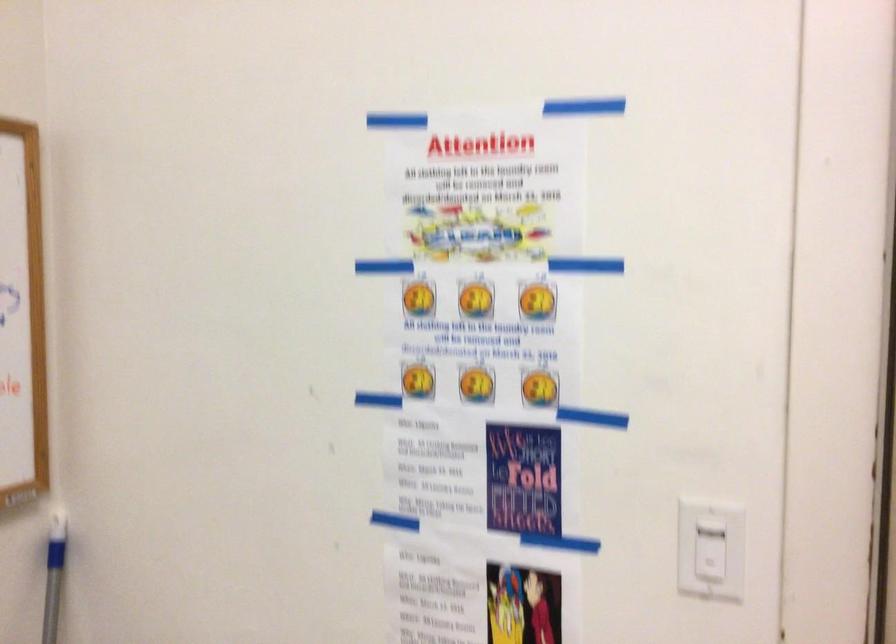
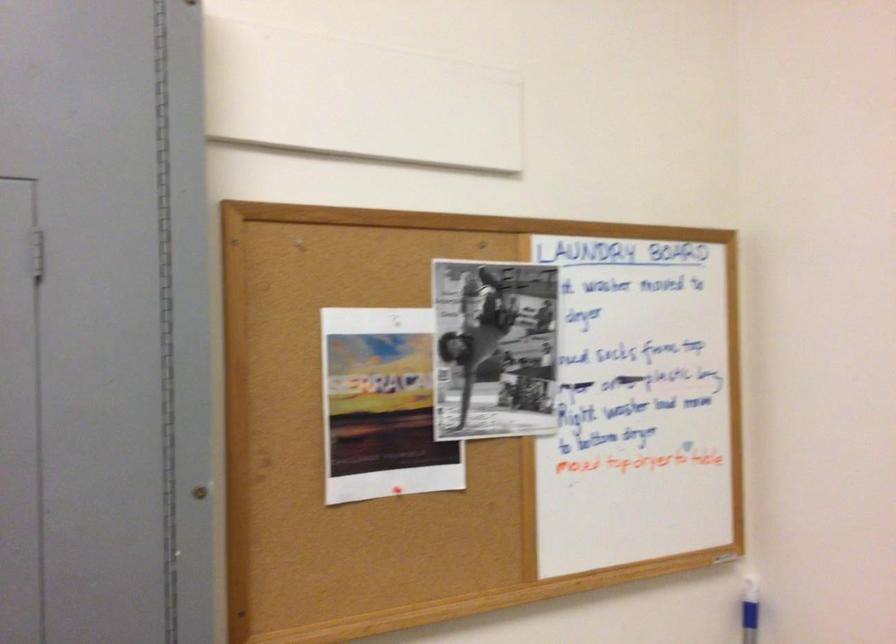
First-person continuous shooting, in which direction is the camera rotating?

The camera's rotation is toward right-down.